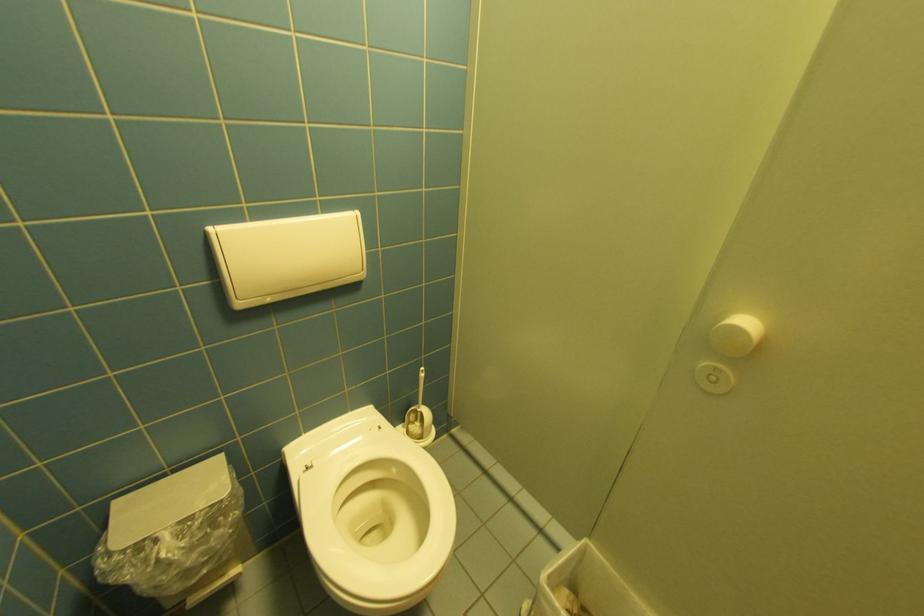
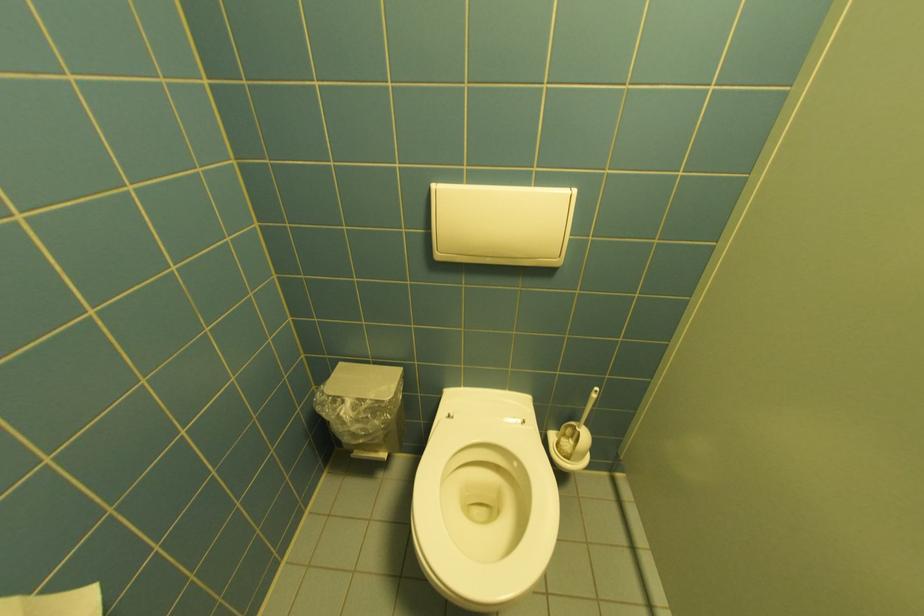
Where in the second image is the point corresponding to the point at 423,437 from the first image?

(570, 455)